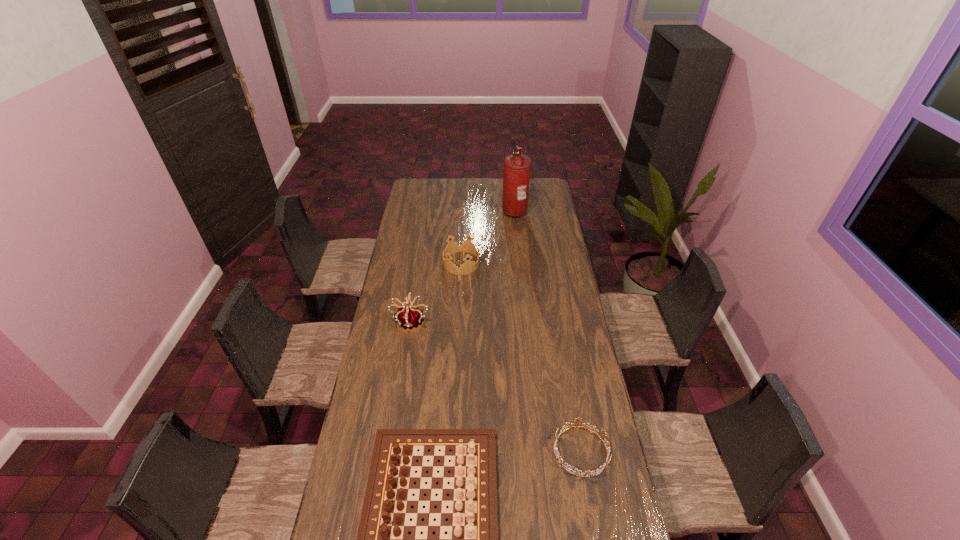
Locate an element on the screen. fire extinguisher is located at coordinates (517, 167).

Identify the location of the farthest object. The height and width of the screenshot is (540, 960). (517, 167).

Where is `the leftmost tiara`? the leftmost tiara is located at coordinates 410,318.

Find the location of `the second farthest tiara`. the second farthest tiara is located at coordinates (410, 318).

Where is `the farthest tiara`? the farthest tiara is located at coordinates (469, 266).

Identify the location of the second shortest tiara. This screenshot has width=960, height=540. (469, 266).

Image resolution: width=960 pixels, height=540 pixels. In order to click on the rightmost tiara in this screenshot , I will do `click(578, 419)`.

Where is `the shortest tiara`? The image size is (960, 540). the shortest tiara is located at coordinates (578, 419).

You are a GUI agent. You are given a task and a screenshot of the screen. Output one action in this format:
    pyautogui.click(x=<x>, y=<y>)
    Task: Click on the blank space located at the front of the farthest object where the nozzle is aimed
    This screenshot has width=960, height=540.
    Given the screenshot: What is the action you would take?
    pyautogui.click(x=441, y=210)

This screenshot has width=960, height=540. What are the coordinates of `free spot located at the front of the farthest object where the nozzle is aimed` in the screenshot? It's located at (472, 210).